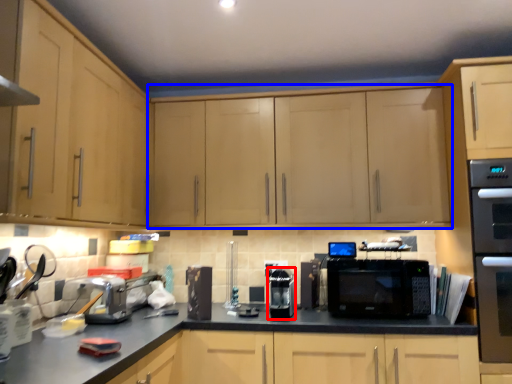
Question: Which point is closer to the camera, appliance (highlighted by a red box) or cabinetry (highlighted by a blue box)?

Choices:
 (A) appliance
 (B) cabinetry

Answer: (A)